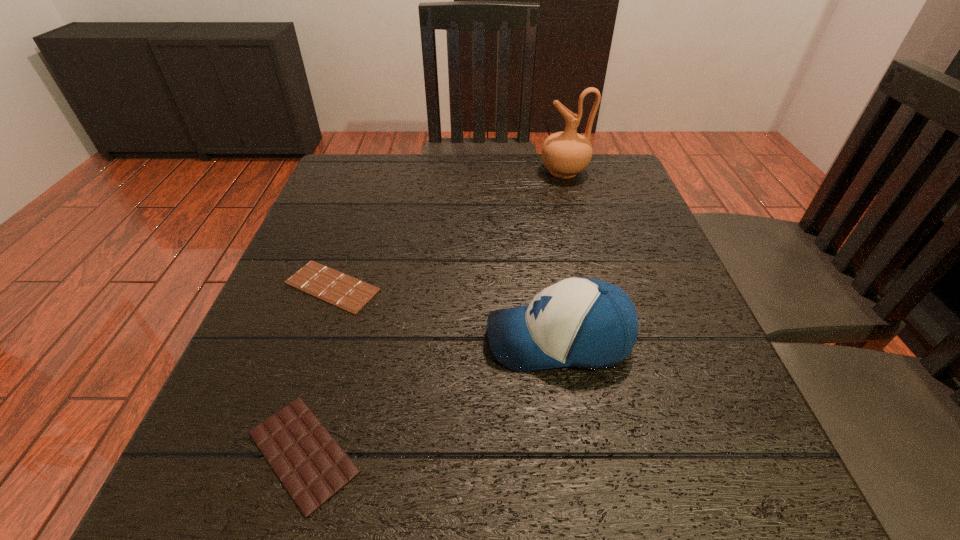
Where is `vacant space located 0.170m on the front-facing side of the baseball cap`? This screenshot has width=960, height=540. vacant space located 0.170m on the front-facing side of the baseball cap is located at coordinates (385, 340).

The image size is (960, 540). I want to click on vacant point located on the back of the farther chocolate bar, so click(x=348, y=242).

I want to click on blank space located 0.170m on the right of the nearer chocolate bar, so click(491, 452).

I want to click on object positioned at the far edge, so click(x=565, y=154).

Find the location of a particular element. object positioned at the near edge is located at coordinates (312, 466).

Identify the location of pottery that is at the right edge. Image resolution: width=960 pixels, height=540 pixels. (565, 154).

Find the location of a particular element. This screenshot has height=540, width=960. baseball cap located at the right edge is located at coordinates (587, 323).

Identify the location of object that is at the near left corner. (312, 466).

Identify the location of object situated at the far right corner. (565, 154).

In the image, there is a desktop. At what (x,y) coordinates should I click in order to perform the action: click on vacant region at the far edge. Please return your answer as a coordinate pair (x, y). Image resolution: width=960 pixels, height=540 pixels. Looking at the image, I should click on (476, 167).